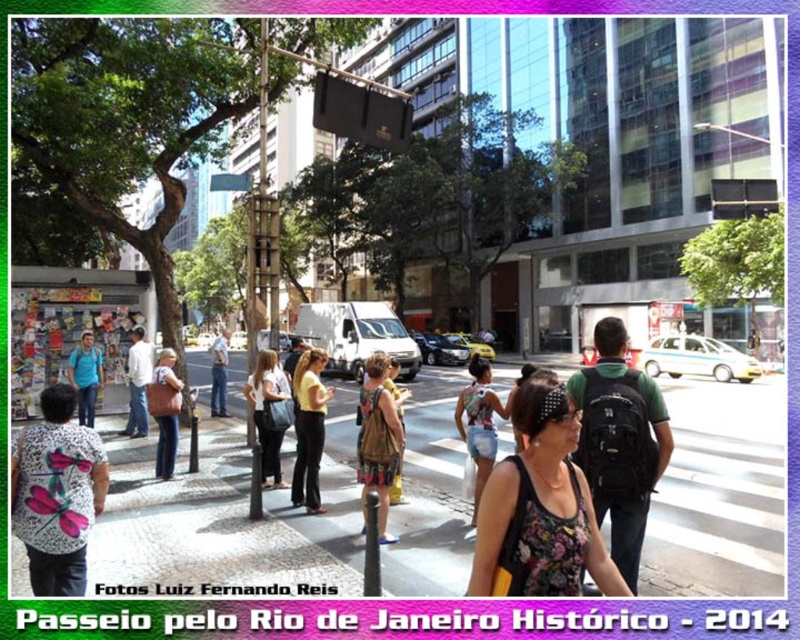
You are a photographer trying to capture a candid shot of the yellow fabric shirt at center and the light blue jeans at center in the busy street scene. Since you want both subjects to be clearly visible in your photo, which object should you focus on to ensure it doesn t get cropped out?

You should focus on the light blue jeans at center because it occupies more space than the yellow fabric shirt at center, making it less likely to be cropped out in the photo.

In the scene shown: You are a photographer standing on the sidewalk in Rio de Janeiro, Brazil, and you want to take a photo of the floral fabric tank top at center and the matte black pants at center. Which object is positioned closer to your camera lens?

The floral fabric tank top at center is closer to the viewer than matte black pants at center, so the floral fabric tank top at center will appear closer to your camera lens.